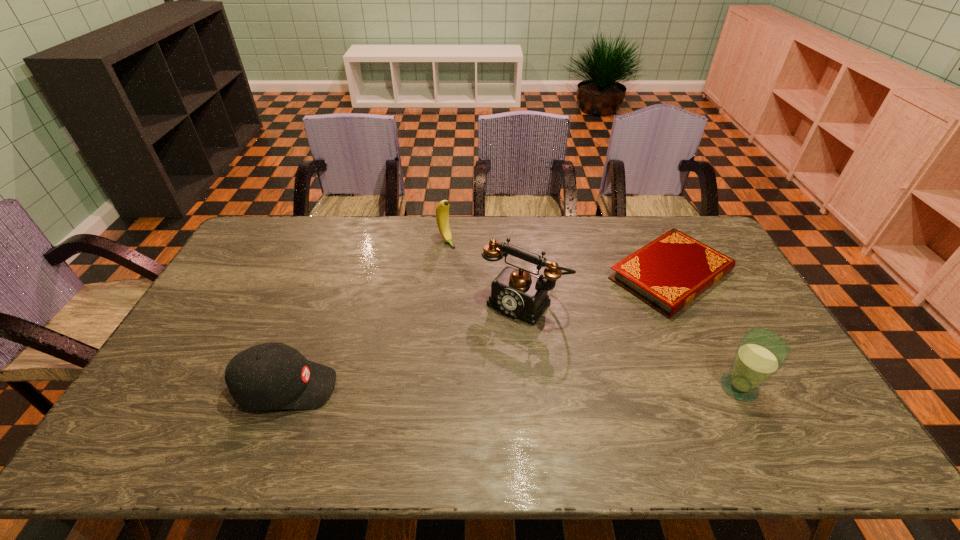
This screenshot has height=540, width=960. In order to click on free space located 0.330m on the front of the tallest object at the rotary dial in this screenshot , I will do `click(437, 404)`.

The width and height of the screenshot is (960, 540). What are the coordinates of `vacant space located 0.080m on the front of the tallest object at the rotary dial` in the screenshot? It's located at (488, 340).

What are the coordinates of `free region located 0.100m from the stem of the second object from left to right` in the screenshot? It's located at (465, 263).

The image size is (960, 540). Identify the location of free point located 0.330m from the stem of the second object from left to right. tap(501, 303).

Find the location of a particular element. blank space located from the stem of the second object from left to right is located at coordinates (488, 288).

Locate an element on the screen. The height and width of the screenshot is (540, 960). free spot located 0.150m on the cover of the shortest object is located at coordinates (598, 323).

Locate an element on the screen. The image size is (960, 540). free space located 0.150m on the cover of the shortest object is located at coordinates (598, 323).

Locate an element on the screen. The width and height of the screenshot is (960, 540). vacant space located on the cover of the shortest object is located at coordinates (560, 349).

This screenshot has width=960, height=540. What are the coordinates of `banana present at the far edge` in the screenshot? It's located at (442, 210).

Where is `hardback book present at the far edge`? The height and width of the screenshot is (540, 960). hardback book present at the far edge is located at coordinates (668, 273).